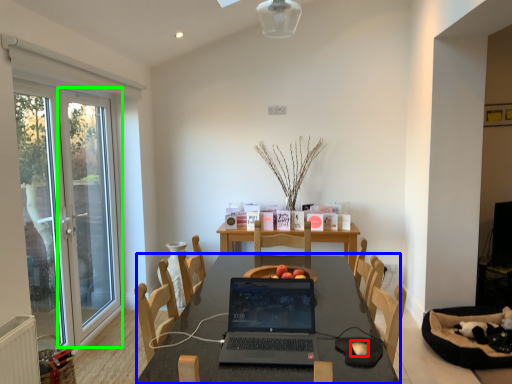
Question: Based on their relative distances, which object is farther from mouse (highlighted by a red box)? Choose from table (highlighted by a blue box) and screen door (highlighted by a green box).

Choices:
 (A) table
 (B) screen door

Answer: (B)